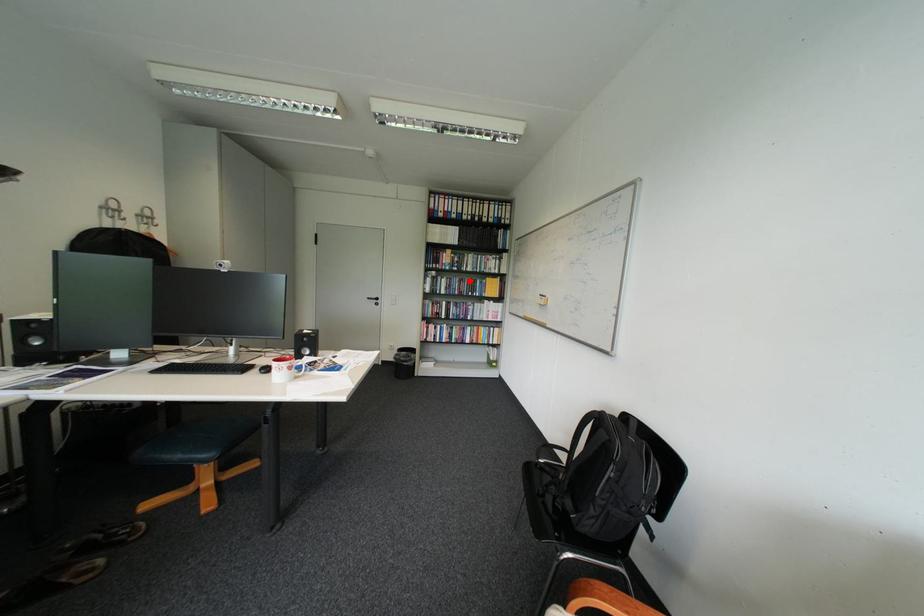
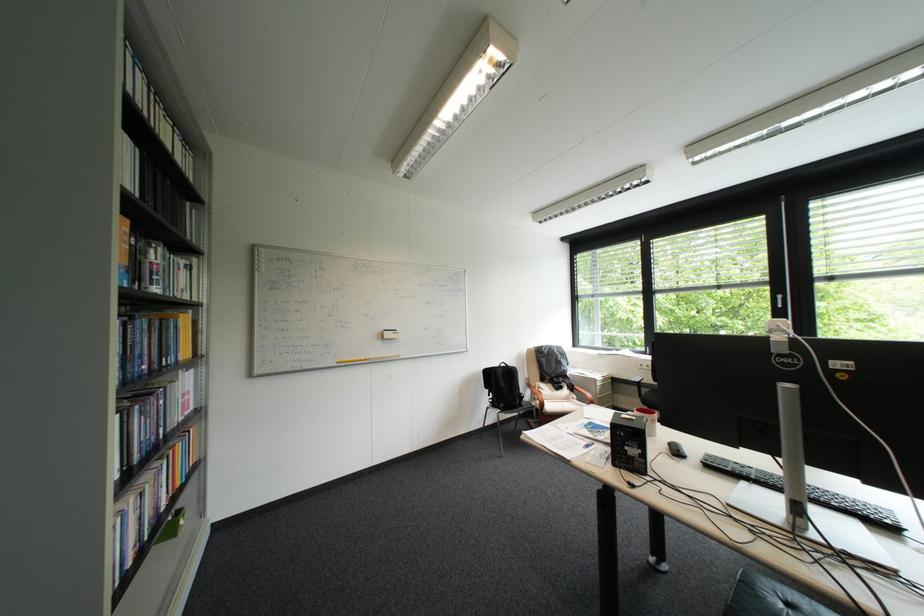
Locate, in the second image, the point that corresponds to the highlighted location in the first image.

(159, 326)